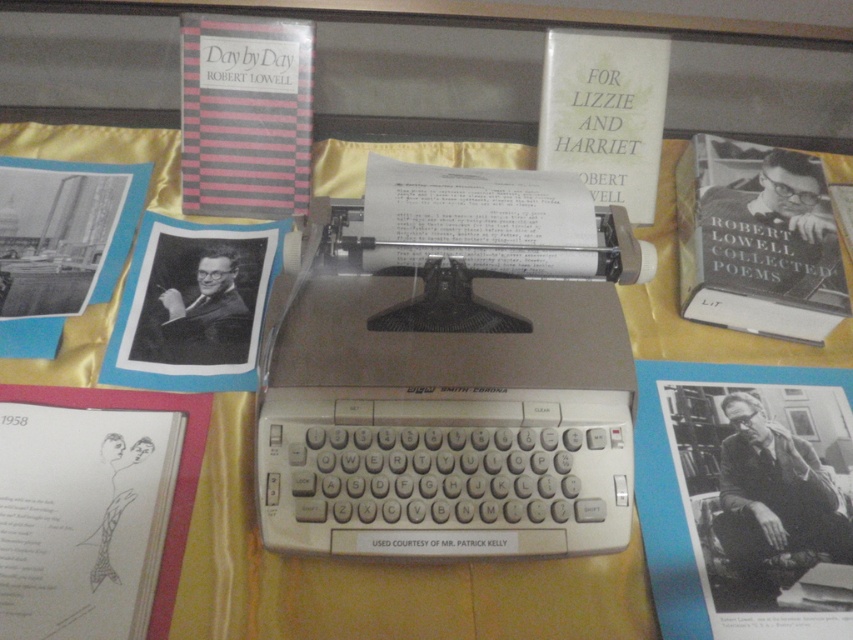
Can you confirm if black paper book at center is positioned above black paper sketch at lower left?

Correct, black paper book at center is located above black paper sketch at lower left.

Which is in front, point (724, 449) or point (165, 461)?

Point (165, 461) is more forward.

Does point (843, 376) come farther from viewer compared to point (97, 445)?

Yes, point (843, 376) is farther from viewer.

You are a GUI agent. You are given a task and a screenshot of the screen. Output one action in this format:
    pyautogui.click(x=<x>, y=<y>)
    Task: Click on the black paper book at center
    This screenshot has width=853, height=640.
    Given the screenshot: What is the action you would take?
    pyautogui.click(x=746, y=499)

This screenshot has width=853, height=640. I want to click on black paper book at center, so click(x=746, y=499).

Who is shorter, black paper book at center or hardcover book at upper right?

hardcover book at upper right

Where is `black paper book at center`? The image size is (853, 640). black paper book at center is located at coordinates (746, 499).

Is hardcover book at right positioned in front of hardcover book at upper right?

That is True.

Is point (720, 156) positioned behind point (616, 100)?

That is True.

Find the location of a particular element. Image resolution: width=853 pixels, height=640 pixels. hardcover book at right is located at coordinates (757, 241).